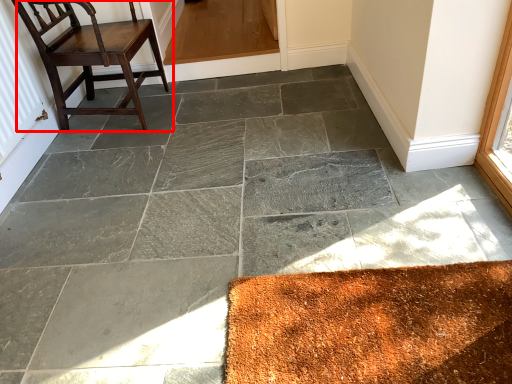
Question: From the image's perspective, considering the relative positions of chair (annotated by the red box) and radiator in the image provided, where is chair (annotated by the red box) located with respect to the staircase?

Choices:
 (A) below
 (B) above

Answer: (B)